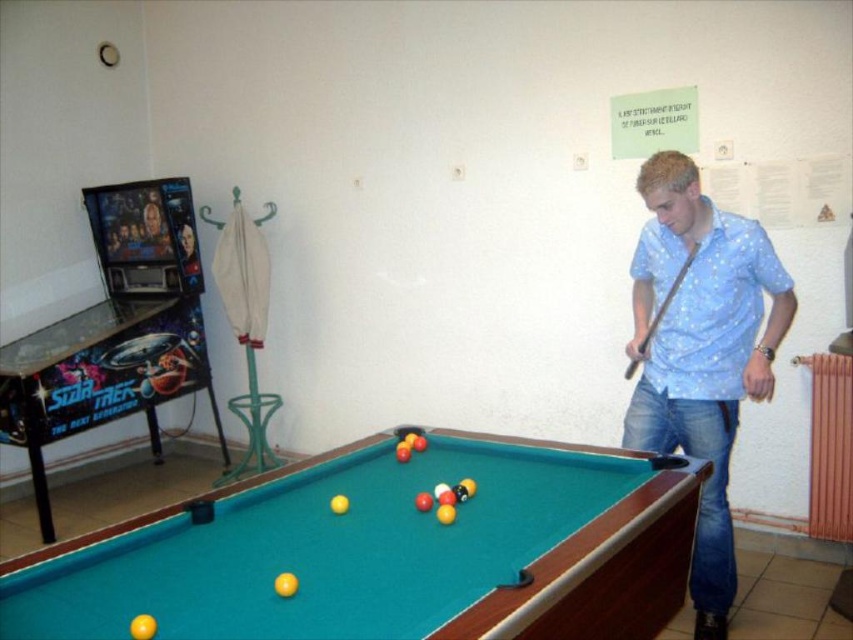
You are standing at the point marked as point [137,561]. You want to take a photo of the pool table. The camera you are holding has a focal length of 50mm and a sensor size of 24mm x 36mm. What is the minimum distance you need to move forward to ensure the entire pool table fits in the frame?

The point [137,561] and camera are 1.80 meters apart. To calculate the minimum distance needed, first determine the field of view. With a 50mm lens on a 24x36mm sensor, the horizontal FOV is approximately 39.6 degrees. Using trigonometry, the required distance can be calculated to ensure the pool table fits within the frame. However, since the current distance is 1.80 meters, moving closer than this might be necessary. However, without knowing the pool table dimensions, an exact calculation isn

You are a pool ball that is 5 cm in diameter. You are currently resting on the green felt billiard table at center. You want to roll towards the blue dotted shirt at right. Is there enough space between the edge of the table and the shirt to move freely?

The green felt billiard table at center is wider than the blue dotted shirt at right. Since the table is wider, the edge closest to the shirt likely has sufficient space for the ball to roll towards the shirt without obstruction.